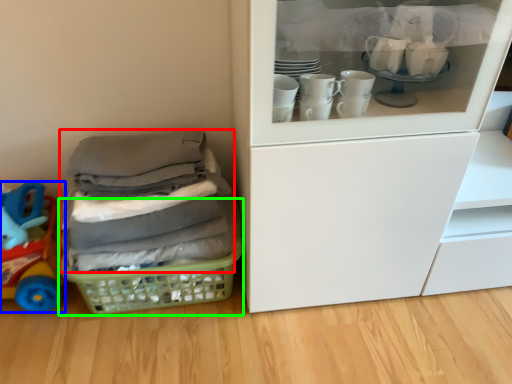
Question: Estimate the real-world distances between objects in this image. Which object is closer to clothing (highlighted by a red box), toy (highlighted by a blue box) or basket (highlighted by a green box)?

Choices:
 (A) toy
 (B) basket

Answer: (B)